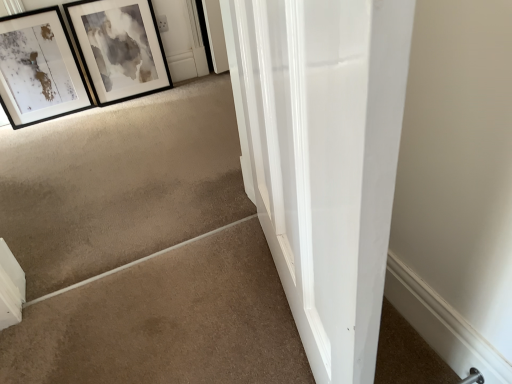
What do you see at coordinates (166, 321) in the screenshot? I see `beige carpet at lower left` at bounding box center [166, 321].

I want to click on beige carpet at lower left, so click(166, 321).

Is the depth of beige carpet at lower left greater than that of black matte picture frame at upper left, marked as the second picture frame in a left-to-right arrangement?

No, beige carpet at lower left is closer to the viewer.

Could you measure the distance between beige carpet at lower left and black matte picture frame at upper left, which is counted as the first picture frame, starting from the right?

A distance of 1.46 meters exists between beige carpet at lower left and black matte picture frame at upper left, which is counted as the first picture frame, starting from the right.

Between beige carpet at lower left and black matte picture frame at upper left, marked as the second picture frame in a left-to-right arrangement, which one has smaller width?

black matte picture frame at upper left, marked as the second picture frame in a left-to-right arrangement.

Consider the image. Is beige carpet at lower left in contact with black matte picture frame at upper left, which is counted as the first picture frame, starting from the right?

No, beige carpet at lower left is not touching black matte picture frame at upper left, which is counted as the first picture frame, starting from the right.

Could you tell me if matte black picture frame at upper left, which is the 2th picture frame in right-to-left order, is facing black matte picture frame at upper left, marked as the second picture frame in a left-to-right arrangement?

No, matte black picture frame at upper left, which is the 2th picture frame in right-to-left order, is not turned towards black matte picture frame at upper left, marked as the second picture frame in a left-to-right arrangement.

Is the depth of matte black picture frame at upper left, which is the first picture frame from left to right, greater than that of black matte picture frame at upper left, which is counted as the first picture frame, starting from the right?

No, matte black picture frame at upper left, which is the first picture frame from left to right, is in front of black matte picture frame at upper left, which is counted as the first picture frame, starting from the right.

Between matte black picture frame at upper left, which is the 2th picture frame in right-to-left order, and black matte picture frame at upper left, marked as the second picture frame in a left-to-right arrangement, which one appears on the left side from the viewer's perspective?

matte black picture frame at upper left, which is the 2th picture frame in right-to-left order.

From a real-world perspective, is matte black picture frame at upper left, which is the 2th picture frame in right-to-left order, physically above black matte picture frame at upper left, which is counted as the first picture frame, starting from the right?

Incorrect, from a real-world perspective, matte black picture frame at upper left, which is the 2th picture frame in right-to-left order, is lower than black matte picture frame at upper left, which is counted as the first picture frame, starting from the right.

Is point (89, 48) positioned after point (75, 97)?

No, (89, 48) is closer to viewer.

From a real-world perspective, does black matte picture frame at upper left, marked as the second picture frame in a left-to-right arrangement, sit lower than matte black picture frame at upper left, which is the first picture frame from left to right?

No, from a real-world perspective, black matte picture frame at upper left, marked as the second picture frame in a left-to-right arrangement, is not below matte black picture frame at upper left, which is the first picture frame from left to right.

Could you tell me if black matte picture frame at upper left, marked as the second picture frame in a left-to-right arrangement, is facing matte black picture frame at upper left, which is the first picture frame from left to right?

No, black matte picture frame at upper left, marked as the second picture frame in a left-to-right arrangement, does not turn towards matte black picture frame at upper left, which is the first picture frame from left to right.

How far apart are black matte picture frame at upper left, which is counted as the first picture frame, starting from the right, and matte black picture frame at upper left, which is the 2th picture frame in right-to-left order?

black matte picture frame at upper left, which is counted as the first picture frame, starting from the right, is 8.71 inches away from matte black picture frame at upper left, which is the 2th picture frame in right-to-left order.

What's the angular difference between beige carpet at lower left and matte black picture frame at upper left, which is the first picture frame from left to right,'s facing directions?

The angle between the facing direction of beige carpet at lower left and the facing direction of matte black picture frame at upper left, which is the first picture frame from left to right, is 179 degrees.

From the image's perspective, which is below, beige carpet at lower left or matte black picture frame at upper left, which is the first picture frame from left to right?

beige carpet at lower left, from the image's perspective.

Which is behind, beige carpet at lower left or matte black picture frame at upper left, which is the first picture frame from left to right?

matte black picture frame at upper left, which is the first picture frame from left to right, is further away from the camera.

The width and height of the screenshot is (512, 384). What are the coordinates of `concrete in front of the matte black picture frame at upper left, which is the first picture frame from left to right` in the screenshot? It's located at (166, 321).

From a real-world perspective, between black matte picture frame at upper left, marked as the second picture frame in a left-to-right arrangement, and beige carpet at lower left, who is vertically lower?

beige carpet at lower left, from a real-world perspective.

Would you say beige carpet at lower left is part of black matte picture frame at upper left, marked as the second picture frame in a left-to-right arrangement,'s contents?

No, beige carpet at lower left is not inside black matte picture frame at upper left, marked as the second picture frame in a left-to-right arrangement.

Can you confirm if black matte picture frame at upper left, which is counted as the first picture frame, starting from the right, is shorter than beige carpet at lower left?

Incorrect, the height of black matte picture frame at upper left, which is counted as the first picture frame, starting from the right, does not fall short of that of beige carpet at lower left.

From the image's perspective, relative to beige carpet at lower left, is black matte picture frame at upper left, marked as the second picture frame in a left-to-right arrangement, above or below?

black matte picture frame at upper left, marked as the second picture frame in a left-to-right arrangement, is above beige carpet at lower left.

Identify the location of the 1st picture frame above the beige carpet at lower left (from a real-world perspective). This screenshot has width=512, height=384. pos(39,69).

From their relative heights in the image, would you say matte black picture frame at upper left, which is the first picture frame from left to right, is taller or shorter than beige carpet at lower left?

Considering their sizes, matte black picture frame at upper left, which is the first picture frame from left to right, has more height than beige carpet at lower left.

From the image's perspective, which one is positioned higher, matte black picture frame at upper left, which is the first picture frame from left to right, or beige carpet at lower left?

matte black picture frame at upper left, which is the first picture frame from left to right, from the image's perspective.

At what (x,y) coordinates should I click in order to perform the action: click on the 2nd picture frame positioned above the beige carpet at lower left (from a real-world perspective). Please return your answer as a coordinate pair (x, y). Looking at the image, I should click on (119, 48).

This screenshot has height=384, width=512. In the image, there is a matte black picture frame at upper left, which is the 2th picture frame in right-to-left order. Identify the location of picture frame above it (from the image's perspective). (119, 48).

Considering their positions, is black matte picture frame at upper left, marked as the second picture frame in a left-to-right arrangement, positioned further to matte black picture frame at upper left, which is the first picture frame from left to right, than beige carpet at lower left?

beige carpet at lower left is positioned further to the anchor matte black picture frame at upper left, which is the first picture frame from left to right.

Estimate the real-world distances between objects in this image. Which object is further from black matte picture frame at upper left, marked as the second picture frame in a left-to-right arrangement, beige carpet at lower left or matte black picture frame at upper left, which is the first picture frame from left to right?

beige carpet at lower left is further to black matte picture frame at upper left, marked as the second picture frame in a left-to-right arrangement.

When comparing their distances from beige carpet at lower left, does matte black picture frame at upper left, which is the first picture frame from left to right, or black matte picture frame at upper left, which is counted as the first picture frame, starting from the right, seem further?

black matte picture frame at upper left, which is counted as the first picture frame, starting from the right, is further to beige carpet at lower left.

Considering their positions, is matte black picture frame at upper left, which is the 2th picture frame in right-to-left order, positioned further to black matte picture frame at upper left, marked as the second picture frame in a left-to-right arrangement, than beige carpet at lower left?

beige carpet at lower left is further to black matte picture frame at upper left, marked as the second picture frame in a left-to-right arrangement.

Based on the photo, estimate the real-world distances between objects in this image. Which object is closer to matte black picture frame at upper left, which is the first picture frame from left to right, beige carpet at lower left or black matte picture frame at upper left, which is counted as the first picture frame, starting from the right?

Based on the image, black matte picture frame at upper left, which is counted as the first picture frame, starting from the right, appears to be nearer to matte black picture frame at upper left, which is the first picture frame from left to right.

From the image, which object appears to be nearer to beige carpet at lower left, black matte picture frame at upper left, which is counted as the first picture frame, starting from the right, or matte black picture frame at upper left, which is the first picture frame from left to right?

matte black picture frame at upper left, which is the first picture frame from left to right, is closer to beige carpet at lower left.

Where is `picture frame between beige carpet at lower left and black matte picture frame at upper left, marked as the second picture frame in a left-to-right arrangement, from front to back`? This screenshot has width=512, height=384. picture frame between beige carpet at lower left and black matte picture frame at upper left, marked as the second picture frame in a left-to-right arrangement, from front to back is located at coordinates [39, 69].